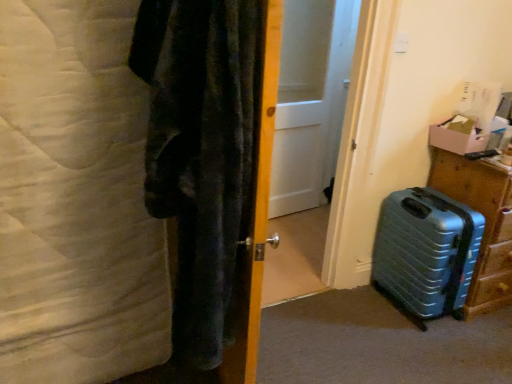
Question: In terms of size, does white matte door at center appear bigger or smaller than wooden door at center?

Choices:
 (A) big
 (B) small

Answer: (B)

Question: Relative to wooden door at center, is white matte door at center in front or behind?

Choices:
 (A) behind
 (B) front

Answer: (A)

Question: Which of these objects is positioned closest to the white soft blanket at left?

Choices:
 (A) metallic blue suitcase at lower right
 (B) white matte door at center
 (C) cardboard box at right
 (D) metallic blue suitcase at lower right
 (E) wooden door at center

Answer: (E)

Question: Estimate the real-world distances between objects in this image. Which object is closer to the metallic blue suitcase at lower right?

Choices:
 (A) white matte door at center
 (B) metallic blue suitcase at lower right
 (C) wooden door at center
 (D) white soft blanket at left
 (E) cardboard box at right

Answer: (B)